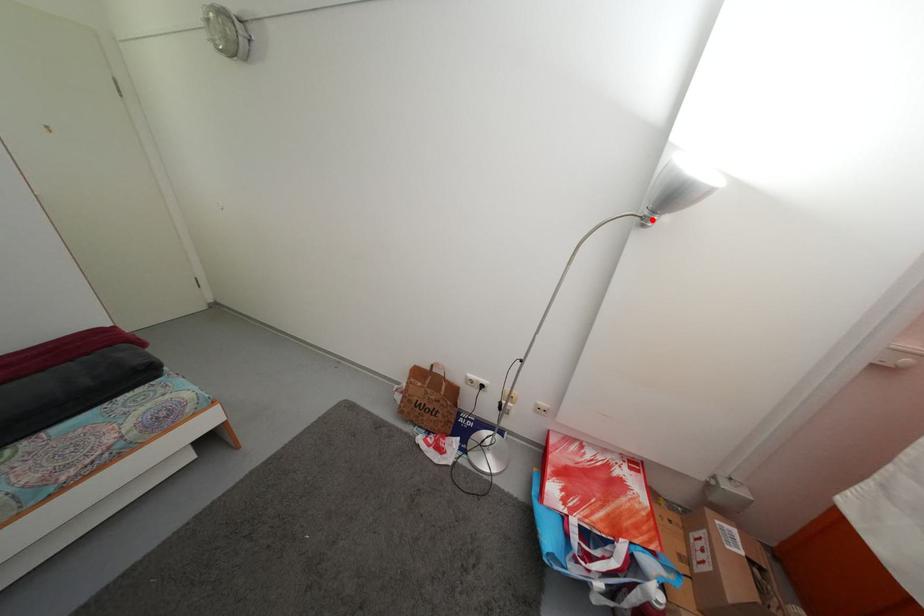
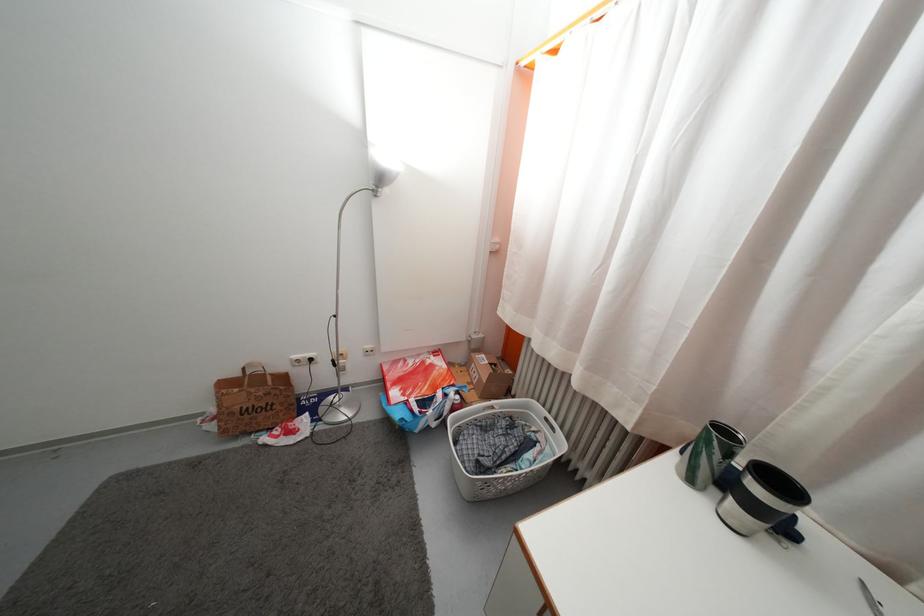
Question: I am providing you with two images of the same scene from different viewpoints. A red point is marked on the first image. Is the red point's position out of view in image 2?

Choices:
 (A) Yes
 (B) No

Answer: (B)